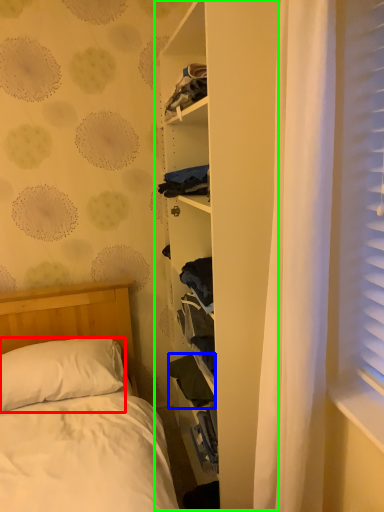
Question: Which object is positioned closest to pillow (highlighted by a red box)? Select from clothing (highlighted by a blue box) and bookshelf (highlighted by a green box).

Choices:
 (A) clothing
 (B) bookshelf

Answer: (A)